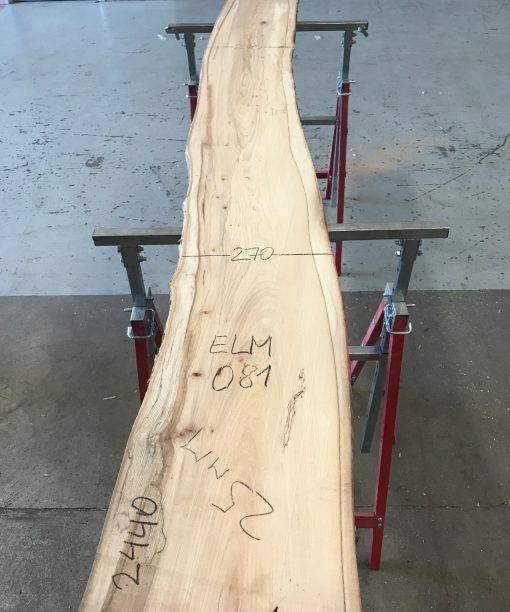
What are the coordinates of `floor` in the screenshot? It's located at (460, 122), (435, 472).